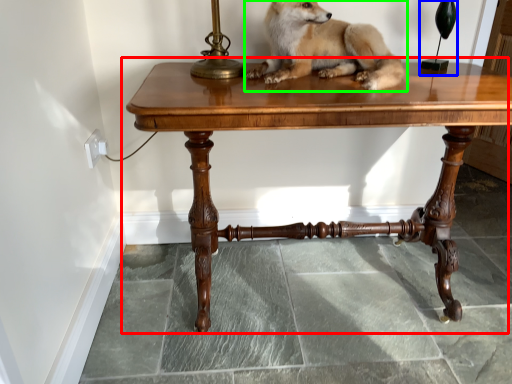
Question: Which object is positioned closest to table (highlighted by a red box)? Select from table lamp (highlighted by a blue box) and dog (highlighted by a green box).

Choices:
 (A) table lamp
 (B) dog

Answer: (B)